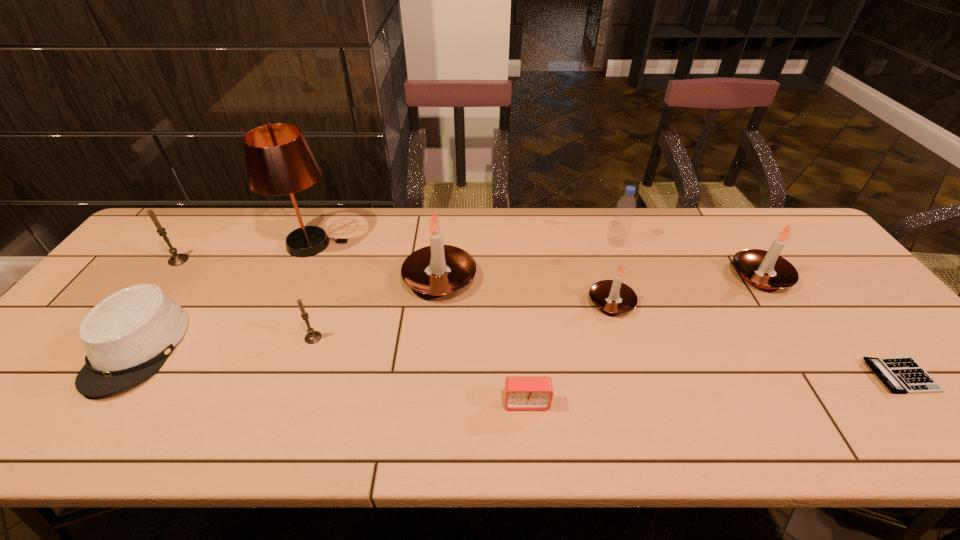
Identify the location of the nearest candle. click(x=312, y=336).

Identify the location of the fourth candle from right to left. The height and width of the screenshot is (540, 960). (312, 336).

This screenshot has height=540, width=960. What are the coordinates of `hat` in the screenshot? It's located at (128, 336).

Identify the location of the fifth object from right to left. The image size is (960, 540). (521, 392).

At what (x,y) coordinates should I click in order to perform the action: click on alarm clock. Please return your answer as a coordinate pair (x, y). Looking at the image, I should click on (521, 392).

Identify the location of the rightmost object. (903, 375).

The image size is (960, 540). Find the location of `calculator`. calculator is located at coordinates (903, 375).

Image resolution: width=960 pixels, height=540 pixels. Find the location of `free region located 0.180m on the front-facing side of the lampshade`. free region located 0.180m on the front-facing side of the lampshade is located at coordinates (405, 244).

Where is `free point located 0.070m on the back of the tallest candle`? The height and width of the screenshot is (540, 960). free point located 0.070m on the back of the tallest candle is located at coordinates [x=444, y=240].

Image resolution: width=960 pixels, height=540 pixels. I want to click on free region located on the right of the blue bottle, so click(749, 242).